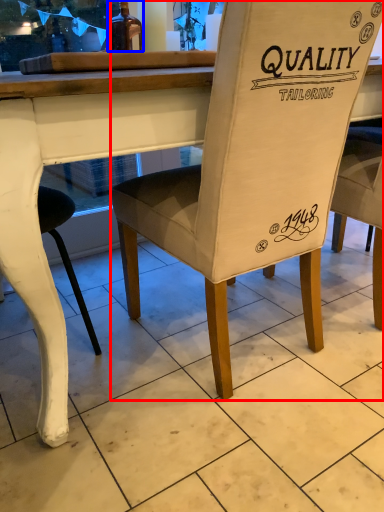
Question: Which object appears closest to the camera in this image, chair (highlighted by a red box) or bottle (highlighted by a blue box)?

Choices:
 (A) chair
 (B) bottle

Answer: (A)